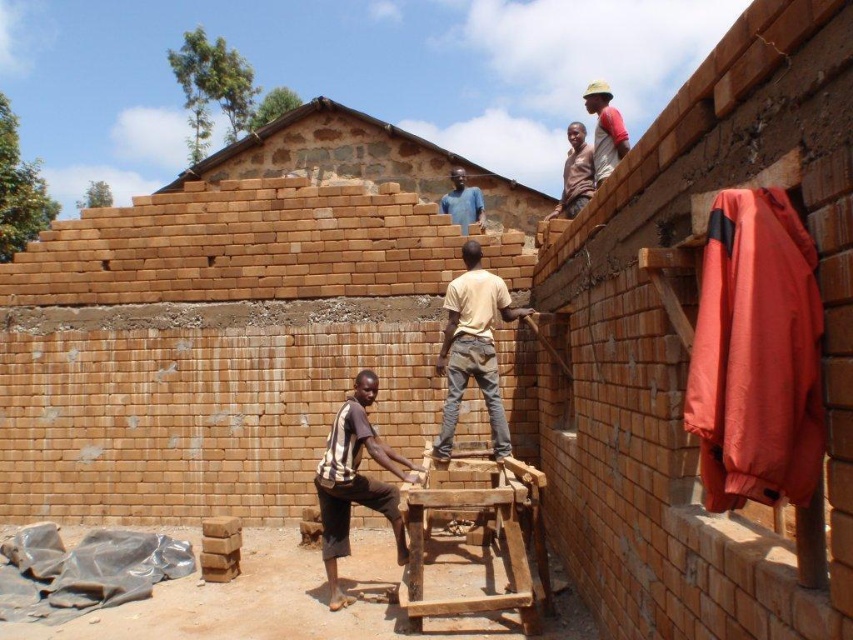
You are a construction worker standing in front of the partially constructed brick wall. You notice the light brown wooden pole at upper center and the blue matte shirt at upper center. Which object is taller?

The light brown wooden pole at upper center is taller than the blue matte shirt at upper center.